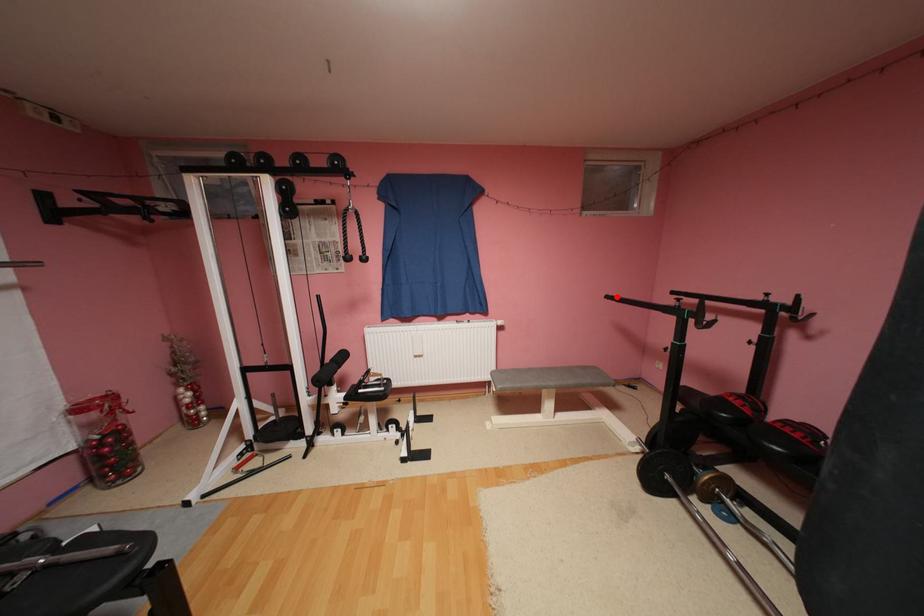
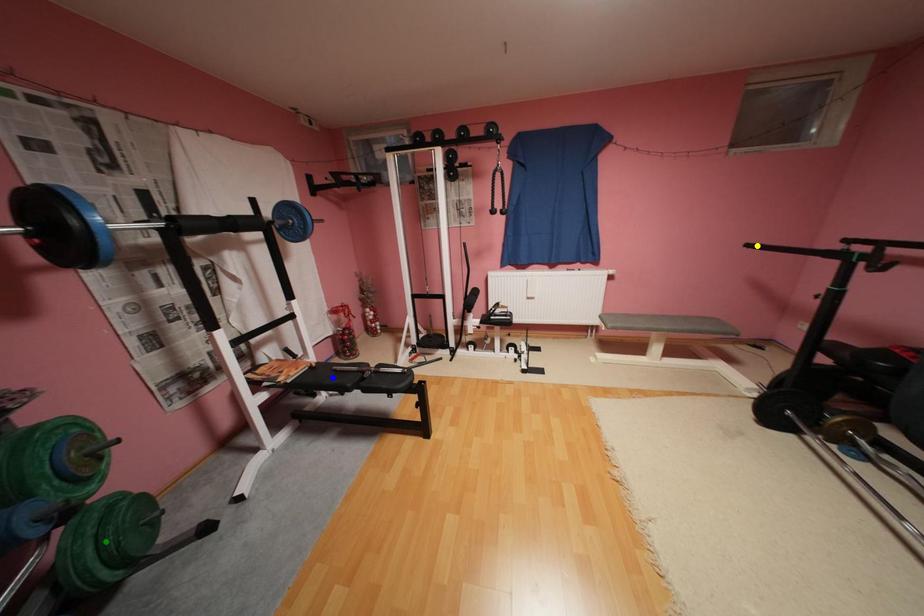
Question: I am providing you with two images of the same scene from different viewpoints. A red point is marked on the first image. You are given multiple points on the second image. Which point in image 2 represents the same 3d spot as the red point in image 1?

Choices:
 (A) blue point
 (B) green point
 (C) yellow point

Answer: (C)